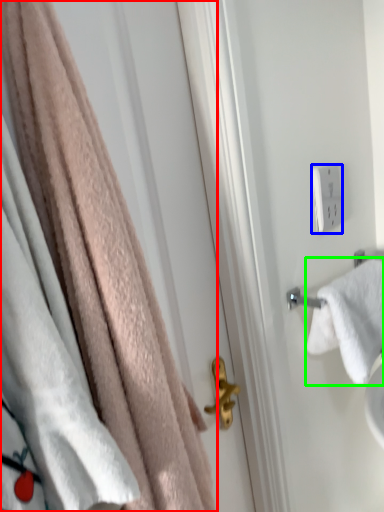
Question: Considering the real-world distances, which object is closest to towel (highlighted by a red box)? light switch (highlighted by a blue box) or towel (highlighted by a green box).

Choices:
 (A) light switch
 (B) towel

Answer: (B)